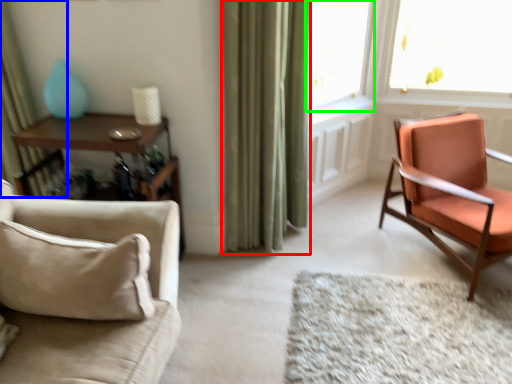
Question: Which object is positioned farthest from curtain (highlighted by a red box)? Select from curtain (highlighted by a blue box) and window (highlighted by a green box).

Choices:
 (A) curtain
 (B) window

Answer: (A)